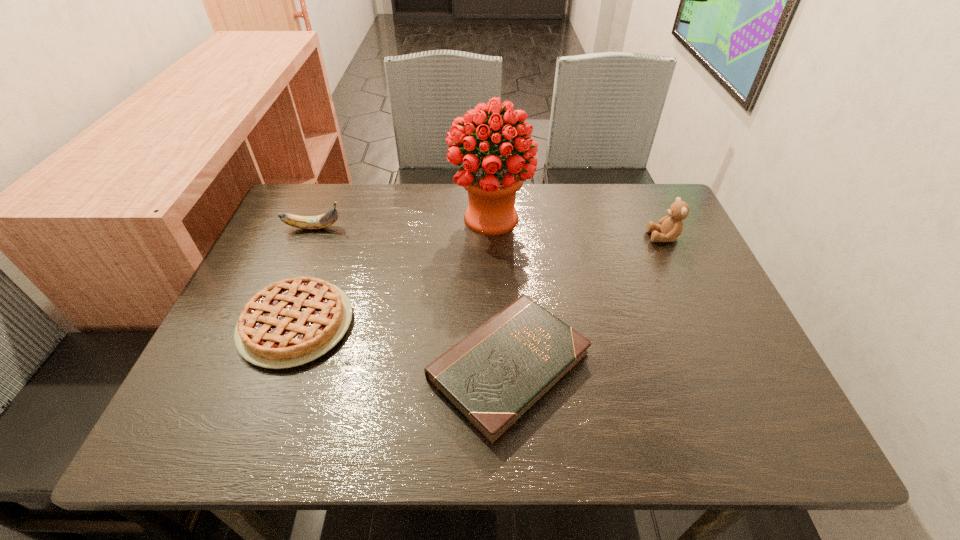
Image resolution: width=960 pixels, height=540 pixels. In order to click on empty location between the teddy bear and the Bible in this screenshot , I will do `click(587, 302)`.

The width and height of the screenshot is (960, 540). I want to click on vacant point located between the pie and the third tallest object, so click(305, 276).

Identify the location of free space between the bouquet and the rightmost object. The height and width of the screenshot is (540, 960). (577, 228).

Find the location of a particular element. This screenshot has width=960, height=540. empty location between the Bible and the second tallest object is located at coordinates (587, 302).

Identify which object is the second nearest to the pie. Please provide its 2D coordinates. Your answer should be formatted as a tuple, i.e. [(x, y)], where the tuple contains the x and y coordinates of a point satisfying the conditions above.

[(321, 221)]

Select which object is the fourth closest to the bouquet. Please provide its 2D coordinates. Your answer should be formatted as a tuple, i.e. [(x, y)], where the tuple contains the x and y coordinates of a point satisfying the conditions above.

[(670, 227)]

Image resolution: width=960 pixels, height=540 pixels. Identify the location of vacant space that satisfies the following two spatial constraints: 1. on the front side of the bouquet; 2. on the peel of the banana. (491, 228).

Where is `free space that satisfies the following two spatial constraints: 1. on the peel of the pie; 2. on the right side of the third tallest object`? The image size is (960, 540). free space that satisfies the following two spatial constraints: 1. on the peel of the pie; 2. on the right side of the third tallest object is located at coordinates (273, 324).